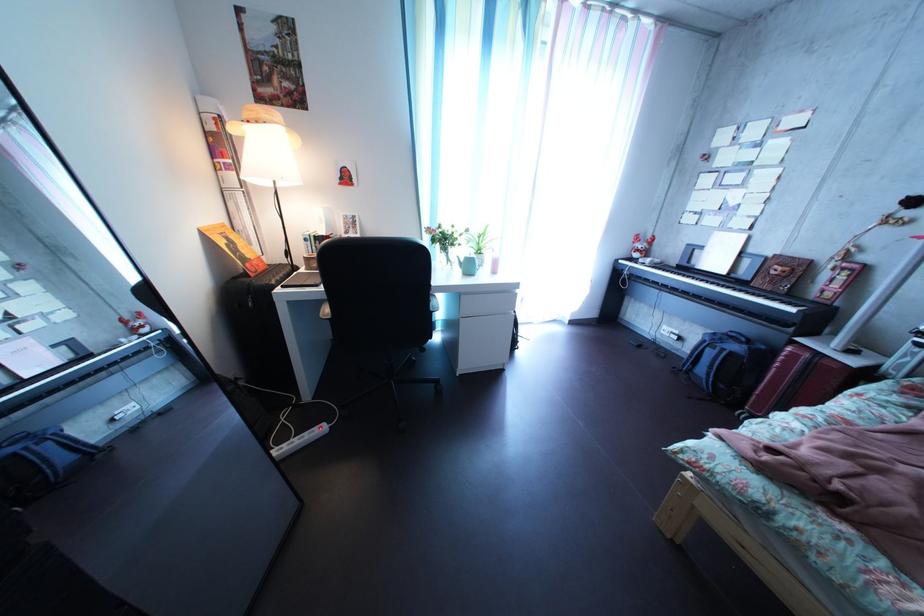
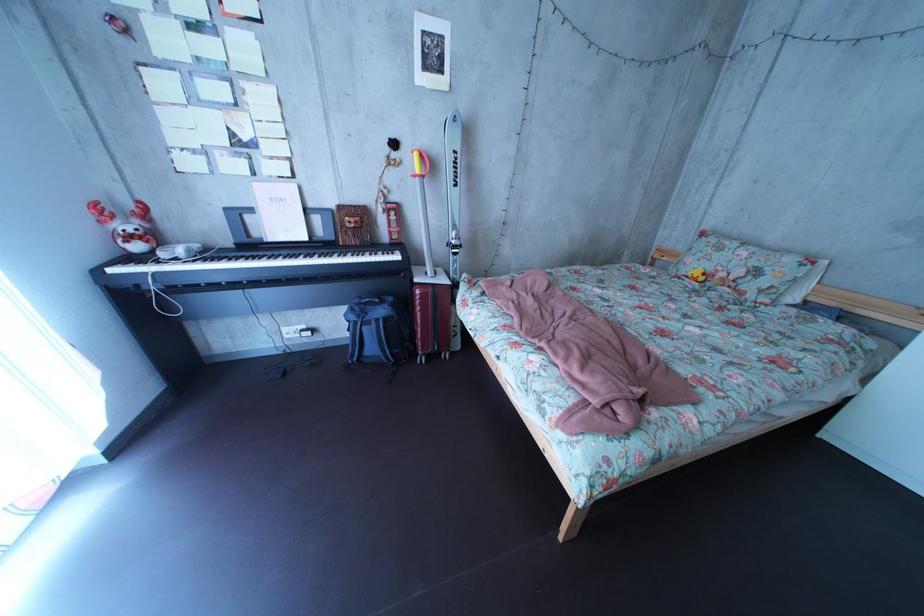
In the second image, find the point that corresponds to point 661,261 in the first image.

(169, 246)